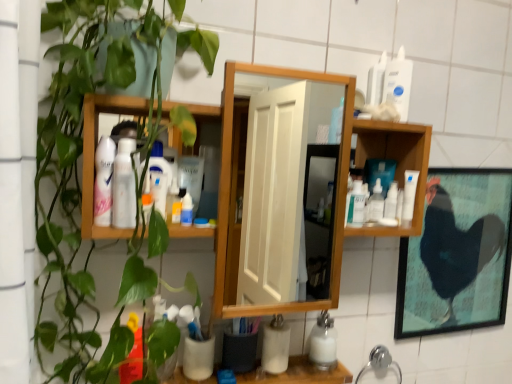
Question: From the image's perspective, is clear plastic bottle at center-right, which is the 2th cleaning product in bottom-to-top order, on green matte plant at left?

Choices:
 (A) no
 (B) yes

Answer: (B)

Question: Is clear plastic bottle at center-right, the 3th cleaning product in the front-to-back sequence, wider than green matte plant at left?

Choices:
 (A) yes
 (B) no

Answer: (B)

Question: Considering the relative sizes of clear plastic bottle at center-right, the 3th cleaning product in the left-to-right sequence, and green matte plant at left in the image provided, is clear plastic bottle at center-right, the 3th cleaning product in the left-to-right sequence, thinner than green matte plant at left?

Choices:
 (A) no
 (B) yes

Answer: (B)

Question: Is clear plastic bottle at center-right, which is the 2th cleaning product in bottom-to-top order, at the left side of green matte plant at left?

Choices:
 (A) yes
 (B) no

Answer: (B)

Question: Can you confirm if clear plastic bottle at center-right, arranged as the third cleaning product when viewed from the top, is shorter than green matte plant at left?

Choices:
 (A) yes
 (B) no

Answer: (A)

Question: Does point (129, 33) appear closer or farther from the camera than point (386, 365)?

Choices:
 (A) farther
 (B) closer

Answer: (B)

Question: Relative to chrome metallic faucet at lower center, is green matte plant at left in front or behind?

Choices:
 (A) behind
 (B) front

Answer: (B)

Question: Considering the positions of green matte plant at left and chrome metallic faucet at lower center in the image, is green matte plant at left bigger or smaller than chrome metallic faucet at lower center?

Choices:
 (A) small
 (B) big

Answer: (B)

Question: From a real-world perspective, relative to chrome metallic faucet at lower center, is green matte plant at left vertically above or below?

Choices:
 (A) above
 (B) below

Answer: (A)

Question: Do you think white glossy bottle at upper right, the third cleaning product in the bottom-to-top sequence, is within clear plastic bottle at center-right, the 3th cleaning product in the front-to-back sequence, or outside of it?

Choices:
 (A) outside
 (B) inside

Answer: (A)

Question: From the image's perspective, is white glossy bottle at upper right, the 3th cleaning product when ordered from back to front, above or below clear plastic bottle at center-right, which is the 2th cleaning product in bottom-to-top order?

Choices:
 (A) below
 (B) above

Answer: (B)

Question: In terms of height, does white glossy bottle at upper right, the first cleaning product from the right, look taller or shorter compared to clear plastic bottle at center-right, the 3th cleaning product in the front-to-back sequence?

Choices:
 (A) short
 (B) tall

Answer: (B)

Question: Relative to clear plastic bottle at center-right, the 3th cleaning product in the left-to-right sequence, is white glossy bottle at upper right, the second cleaning product in the front-to-back sequence, in front or behind?

Choices:
 (A) behind
 (B) front

Answer: (B)

Question: Is point (309, 380) positioned closer to the camera than point (475, 256)?

Choices:
 (A) farther
 (B) closer

Answer: (B)

Question: In terms of width, does white matte cup at lower center look wider or thinner when compared to black matte chicken at right?

Choices:
 (A) thin
 (B) wide

Answer: (B)